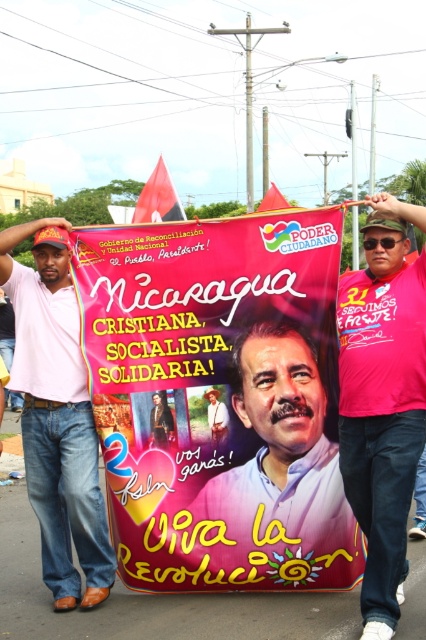
Question: Which is nearer to the pink paper poster at center?

Choices:
 (A) pink fabric shirt at center
 (B) pink cotton shirt at left
 (C) matte pink shirt at center

Answer: (C)

Question: Is pink paper poster at center above matte pink shirt at center?

Choices:
 (A) yes
 (B) no

Answer: (A)

Question: Is pink fabric shirt at center bigger than pink cotton shirt at left?

Choices:
 (A) no
 (B) yes

Answer: (A)

Question: Which point appears farthest from the camera in this image?

Choices:
 (A) (270, 541)
 (B) (138, 524)
 (C) (62, 536)

Answer: (B)

Question: Which object is closer to the camera taking this photo?

Choices:
 (A) pink cotton shirt at left
 (B) pink paper poster at center
 (C) pink fabric shirt at center

Answer: (C)

Question: Is pink fabric shirt at center wider than pink cotton shirt at left?

Choices:
 (A) no
 (B) yes

Answer: (A)